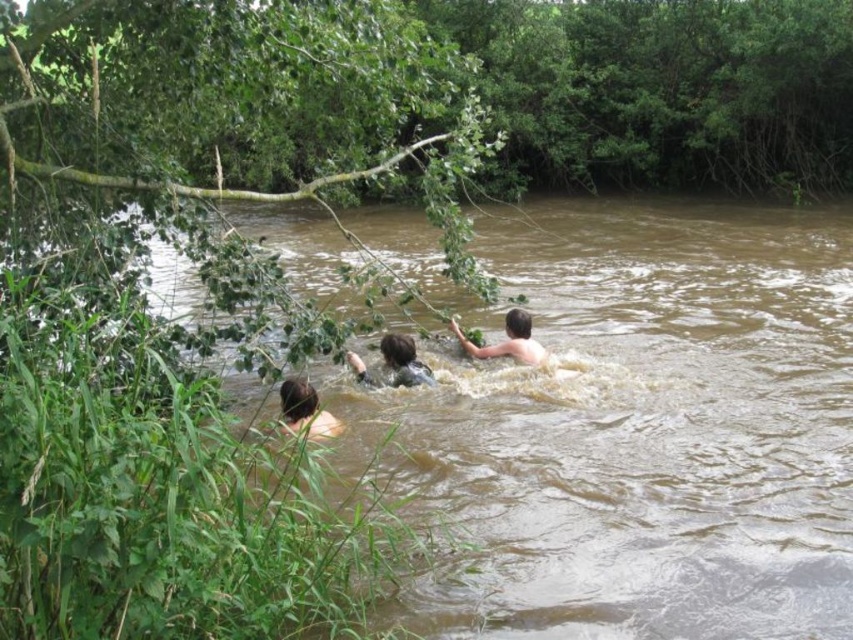
This screenshot has height=640, width=853. What do you see at coordinates (637, 429) in the screenshot? I see `brown muddy water at center` at bounding box center [637, 429].

Is brown muddy water at center taller than light brown skin at center?

Indeed, brown muddy water at center has a greater height compared to light brown skin at center.

Which is behind, point (361, 461) or point (465, 342)?

The point (465, 342) is more distant.

Image resolution: width=853 pixels, height=640 pixels. Find the location of `brown muddy water at center`. brown muddy water at center is located at coordinates (637, 429).

Consider the image. Does brown skin at lower left have a lesser height compared to light brown skin at center?

Correct, brown skin at lower left is not as tall as light brown skin at center.

Who is lower down, brown skin at lower left or light brown skin at center?

brown skin at lower left is below.

Is point (326, 426) positioned in front of point (514, 339)?

Yes, it is.

Identify the location of brown skin at lower left. This screenshot has width=853, height=640. (305, 410).

Does brown muddy water at center appear on the left side of brown skin at lower left?

In fact, brown muddy water at center is to the right of brown skin at lower left.

Can you confirm if brown muddy water at center is positioned to the right of brown skin at lower left?

Indeed, brown muddy water at center is positioned on the right side of brown skin at lower left.

Locate an element on the screen. This screenshot has width=853, height=640. brown muddy water at center is located at coordinates (637, 429).

The height and width of the screenshot is (640, 853). Find the location of `brown muddy water at center`. brown muddy water at center is located at coordinates (637, 429).